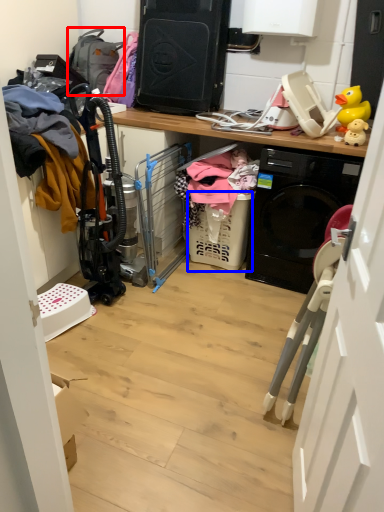
Question: Which point is closer to the camera, backpack (highlighted by a red box) or basket (highlighted by a blue box)?

Choices:
 (A) backpack
 (B) basket

Answer: (B)